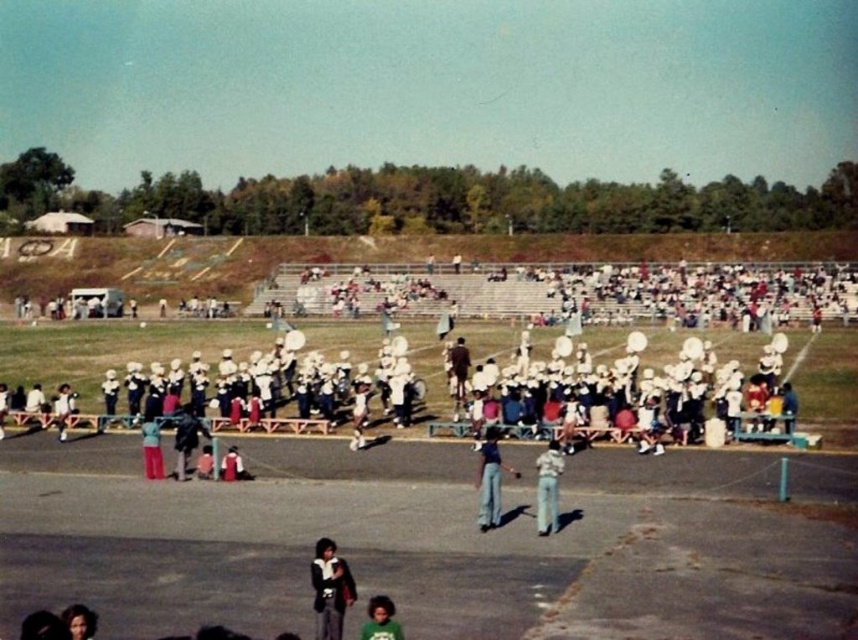
Question: Can you confirm if dark brown leather jacket at lower center is positioned to the right of green matte shirt at lower center?

Choices:
 (A) no
 (B) yes

Answer: (A)

Question: Which object appears closest to the camera in this image?

Choices:
 (A) matte red pants at center
 (B) blue jeans at center
 (C) denim jeans at center

Answer: (C)

Question: Where is dark brown leather jacket at lower center located in relation to matte red pants at center in the image?

Choices:
 (A) right
 (B) left

Answer: (A)

Question: Which object is closer to the camera taking this photo?

Choices:
 (A) blue jeans at center
 (B) smooth skin face at lower left
 (C) matte red pants at center

Answer: (B)

Question: Which point is closer to the camera?

Choices:
 (A) (478, 467)
 (B) (80, 604)

Answer: (B)

Question: Can you confirm if denim jeans at center is wider than smooth skin face at lower left?

Choices:
 (A) yes
 (B) no

Answer: (A)